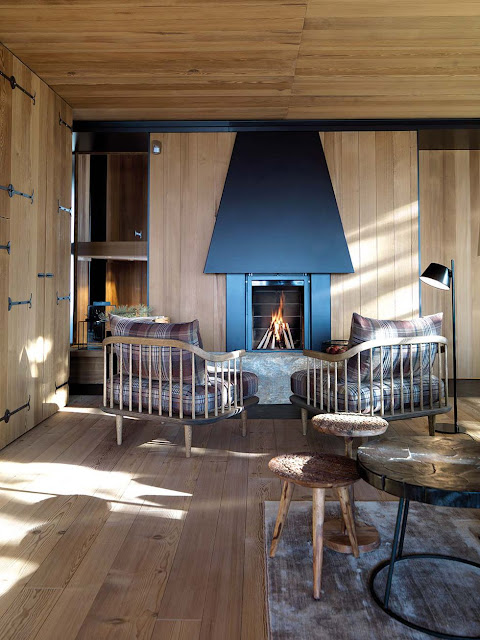
Where is `empty wall space to the right of fire place`? This screenshot has width=480, height=640. empty wall space to the right of fire place is located at coordinates (396, 212).